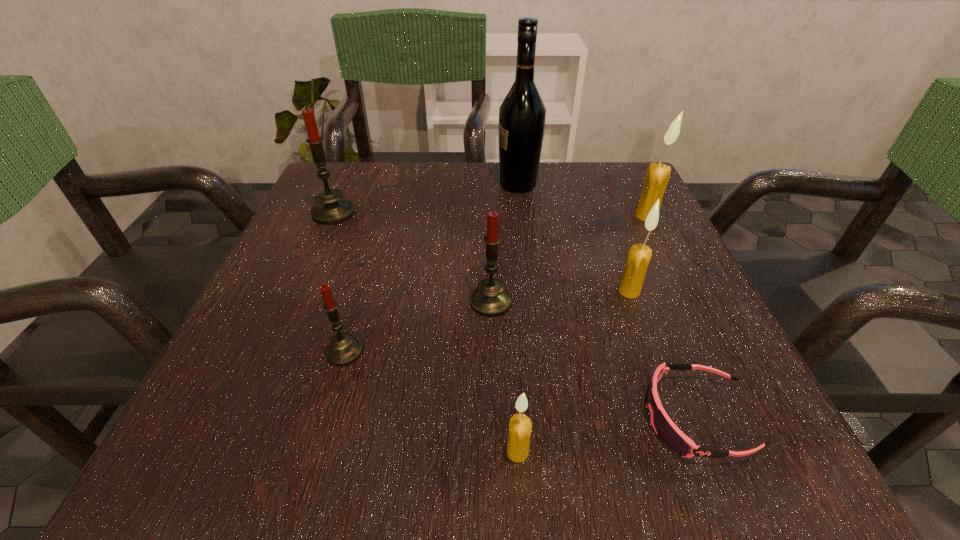
Where is `free region that satisfies the following two spatial constraints: 1. on the label of the second smallest cream candle; 2. on the left side of the wine bottle`? free region that satisfies the following two spatial constraints: 1. on the label of the second smallest cream candle; 2. on the left side of the wine bottle is located at coordinates (531, 291).